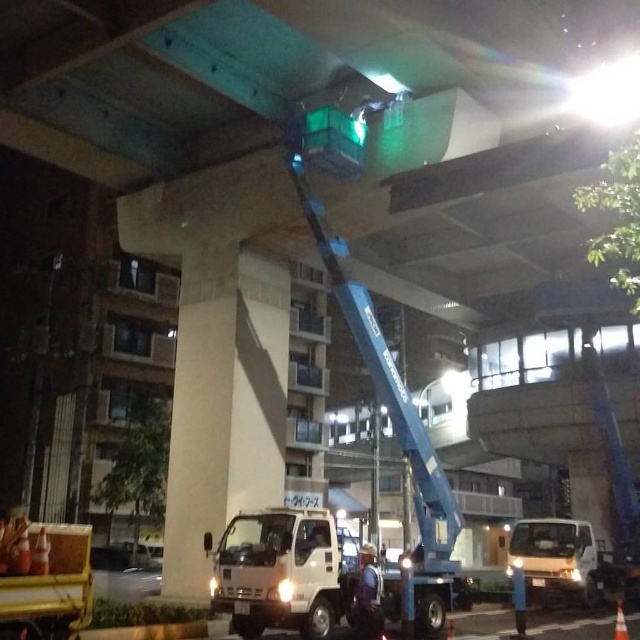
You are a worker standing at the base of the overpass and need to reach the platform of the blue telescopic boom lift. You see two points marked in the image. The first point is at coordinate point(275, 563) and the second point is at coordinate point(627, 634). Which point should you move towards to reach the lift platform?

You should move towards point(275, 563) because it is behind point(627, 634), meaning it is closer to the lift platform located under the overpass.

You are a safety inspector at the construction site. You need to check if the reflective silver vest at center is visible from the control room located behind the white matte truck at lower right. Based on the scene, can you confirm visibility?

The reflective silver vest at center is behind the white matte truck at lower right, so it might be obstructed from view from the control room located behind the truck.

You are a worker who needs to move from the reflective silver vest at center to the white matte truck at lower right. Which direction should you head to reach the truck?

You should head to the right to reach the white matte truck at lower right since it is located to the right of the reflective silver vest at center.